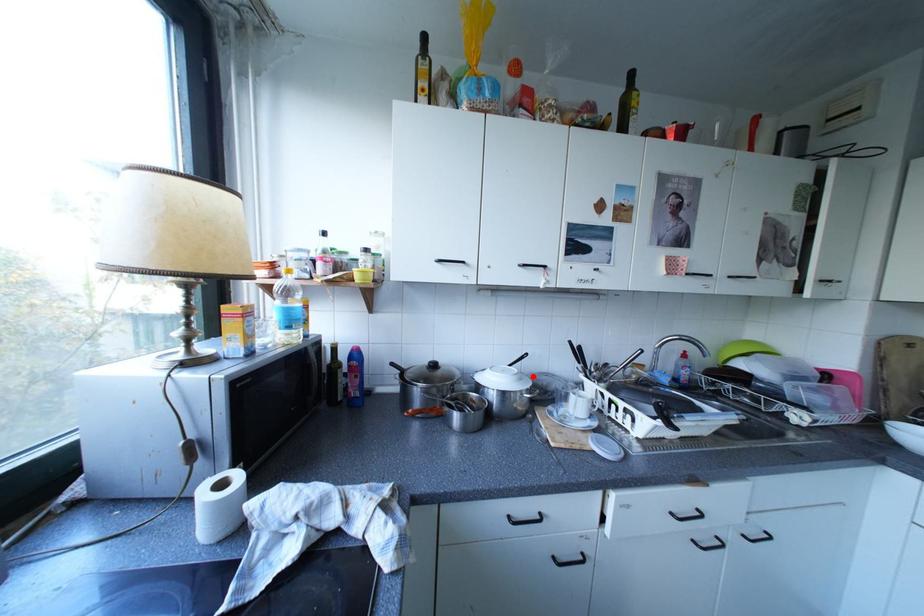
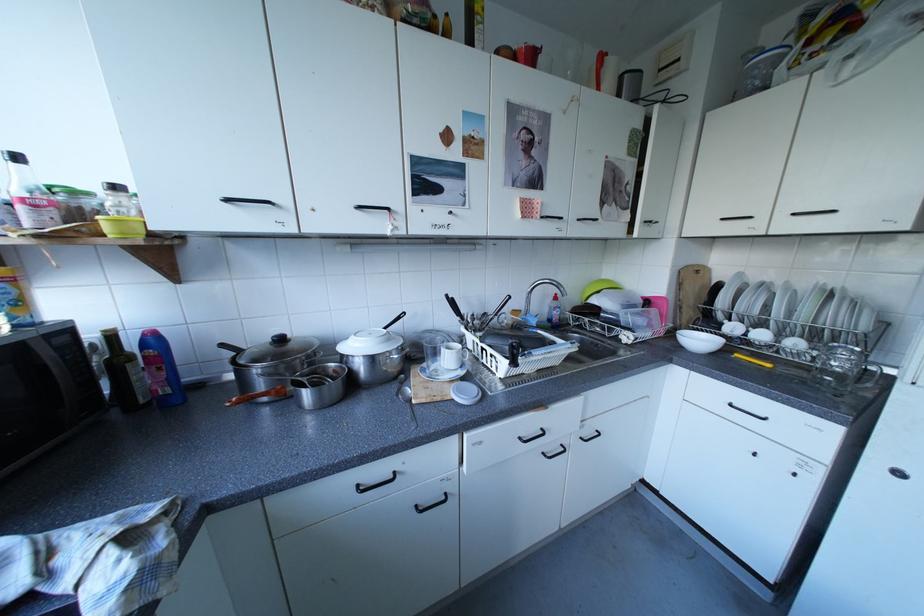
Locate, in the second image, the point that corresponds to the highlighted location in the first image.

(400, 338)